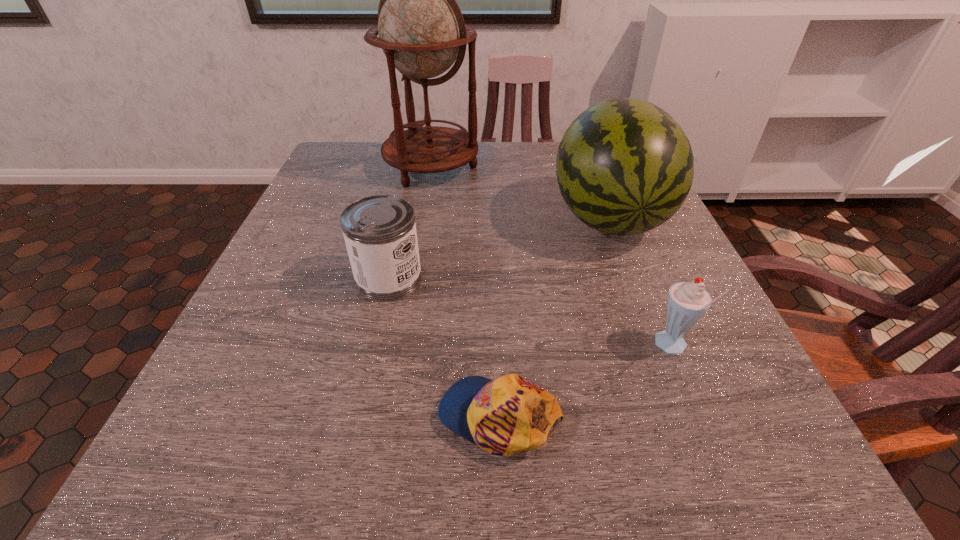
Find the location of a particular element. globe is located at coordinates tap(421, 29).

Locate an element on the screen. the fourth shortest object is located at coordinates (624, 166).

Locate an element on the screen. This screenshot has height=540, width=960. milkshake is located at coordinates (687, 302).

Identify the location of can. The width and height of the screenshot is (960, 540). (380, 234).

Find the location of a particular element. Image resolution: width=960 pixels, height=540 pixels. the nearest object is located at coordinates (508, 415).

This screenshot has height=540, width=960. What are the coordinates of `cap` in the screenshot? It's located at (508, 415).

I want to click on free region located on the surface of the globe, so click(408, 305).

This screenshot has height=540, width=960. Identify the location of free region located at the stem end of the watermelon. (636, 289).

This screenshot has width=960, height=540. Identify the location of vacant position located 0.130m on the straw side of the second nearest object. (570, 347).

Find the location of `free space located 0.290m on the straw side of the second nearest object`. free space located 0.290m on the straw side of the second nearest object is located at coordinates (468, 347).